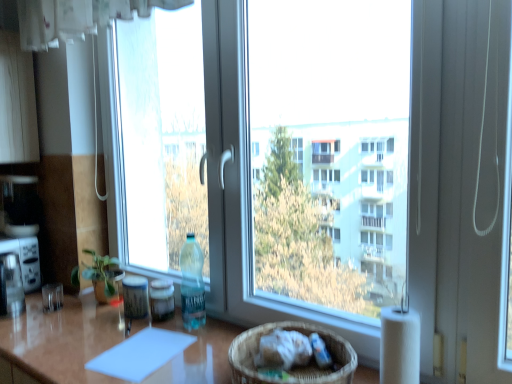
Locate an element on the screen. free point above shiny brown table at center (from a real-world perspective) is located at coordinates (143, 347).